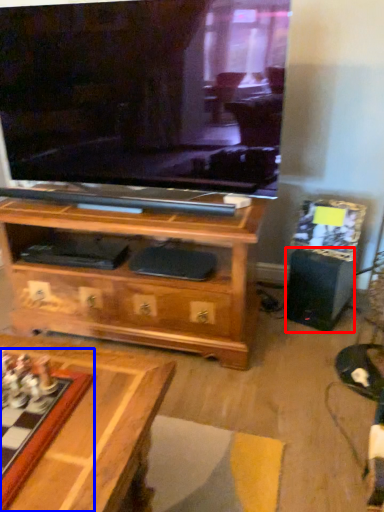
Question: Which object is closer to the camera taking this photo, speaker (highlighted by a red box) or board game (highlighted by a blue box)?

Choices:
 (A) speaker
 (B) board game

Answer: (B)